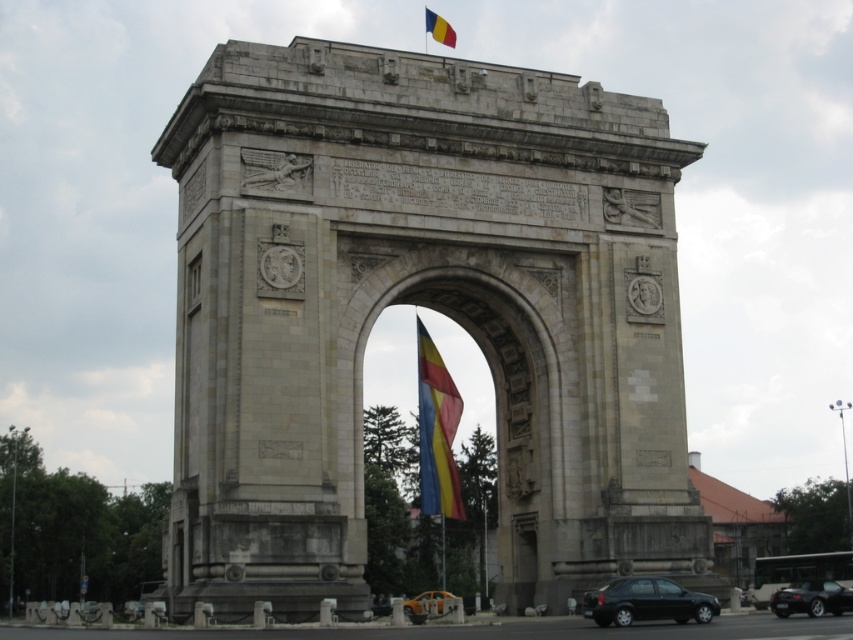
Question: Estimate the real-world distances between objects in this image. Which object is closer to the yellow-red-white striped fabric at top center?

Choices:
 (A) shiny black car at lower right
 (B) polyester flag at center

Answer: (B)

Question: Is polyester flag at center smaller than yellow-red-white striped fabric at top center?

Choices:
 (A) yes
 (B) no

Answer: (B)

Question: Is yellow-red-white striped fabric at top center smaller than yellow matte car at center?

Choices:
 (A) no
 (B) yes

Answer: (B)

Question: Which point is farther to the camera?

Choices:
 (A) 439,40
 (B) 457,476
 (C) 822,598
 (D) 660,102

Answer: (A)

Question: Is polyester flag at center smaller than black matte car at lower right?

Choices:
 (A) yes
 (B) no

Answer: (B)

Question: Which object appears farthest from the camera in this image?

Choices:
 (A) black matte car at lower right
 (B) yellow matte car at center
 (C) stone archway at center

Answer: (B)